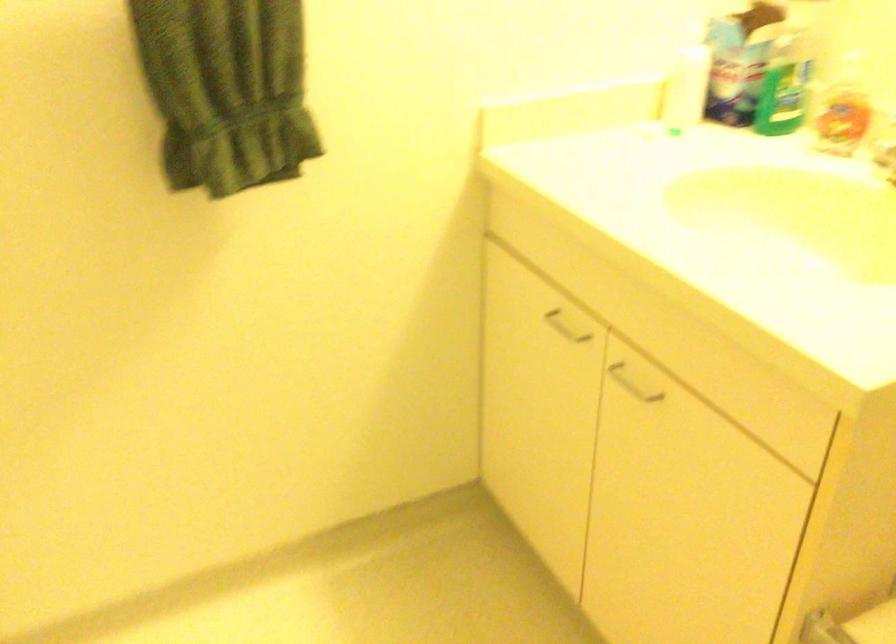
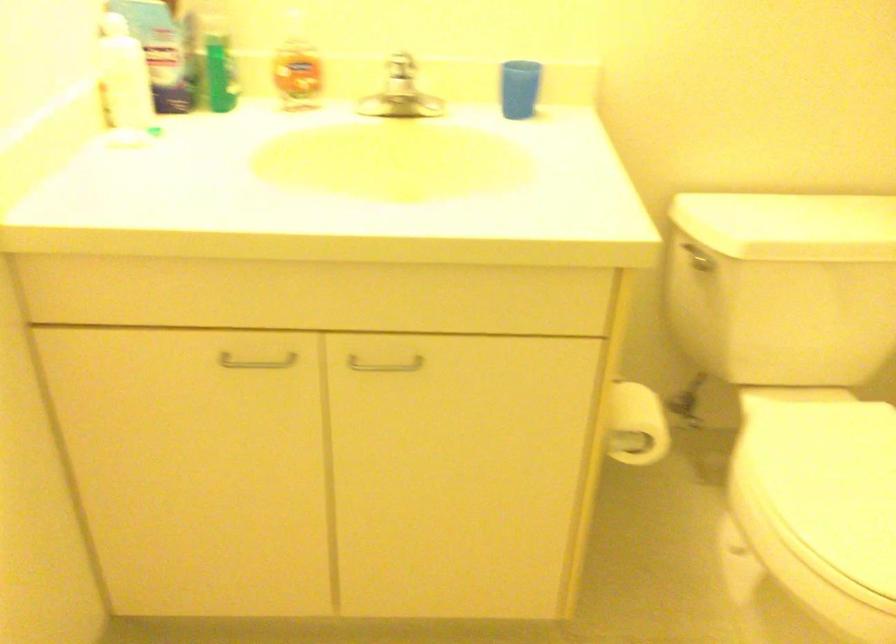
Where in the second image is the point corresponding to point (570, 330) from the first image?

(256, 362)